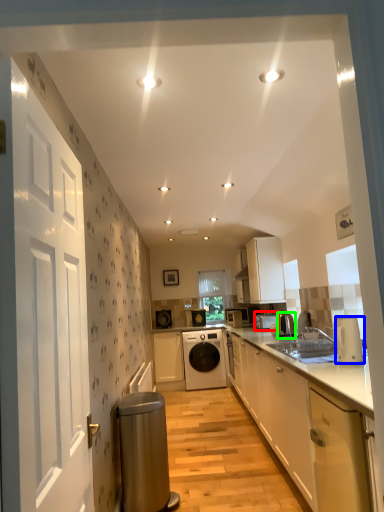
Question: Estimate the real-world distances between objects in this image. Which object is closer to appliance (highlighted by a red box), kitchen appliance (highlighted by a blue box) or appliance (highlighted by a green box)?

Choices:
 (A) kitchen appliance
 (B) appliance

Answer: (B)